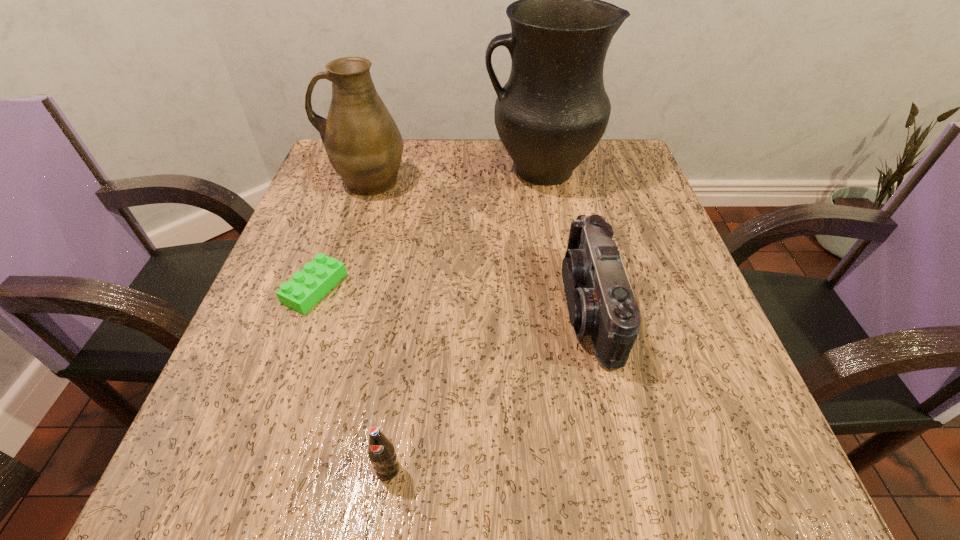
The width and height of the screenshot is (960, 540). Find the location of `object present at the far left corner`. object present at the far left corner is located at coordinates (363, 143).

Locate an element on the screen. The height and width of the screenshot is (540, 960). object that is at the far right corner is located at coordinates (552, 112).

In the image, there is a desktop. What are the coordinates of `vacant space at the far edge` in the screenshot? It's located at (492, 156).

Where is `free location at the near edge of the desktop`? This screenshot has height=540, width=960. free location at the near edge of the desktop is located at coordinates (549, 513).

You are a GUI agent. You are given a task and a screenshot of the screen. Output one action in this format:
    pyautogui.click(x=<x>, y=<y>)
    Task: Click on the vacant region at the left edge
    The height and width of the screenshot is (540, 960).
    Given the screenshot: What is the action you would take?
    pyautogui.click(x=229, y=374)

You are a GUI agent. You are given a task and a screenshot of the screen. Output one action in this format:
    pyautogui.click(x=<x>, y=<y>)
    Task: Click on the vacant region at the right edge of the desktop
    
    Given the screenshot: What is the action you would take?
    643,274

Image resolution: width=960 pixels, height=540 pixels. I want to click on vacant space at the near right corner, so click(x=658, y=483).

Identify the location of free space between the third object from left to right and the right pitcher. The image size is (960, 540). (464, 320).

At what (x,y) coordinates should I click in order to perform the action: click on blank region between the pop and the camcorder. Please return your answer as a coordinate pair (x, y). This screenshot has height=540, width=960. Looking at the image, I should click on (489, 388).

The height and width of the screenshot is (540, 960). Identify the location of free space between the shortest object and the camcorder. (452, 298).